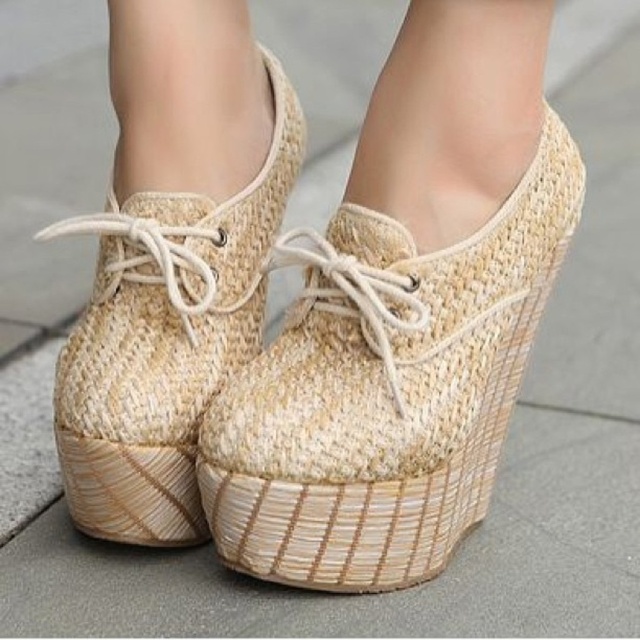
Question: Which of the following is the closest to the observer?

Choices:
 (A) [x=420, y=292]
 (B) [x=200, y=540]

Answer: (A)

Question: Does natural woven shoe at center have a greater width compared to woven beige shoe at center?

Choices:
 (A) yes
 (B) no

Answer: (A)

Question: Does natural woven shoe at center appear over woven beige shoe at center?

Choices:
 (A) yes
 (B) no

Answer: (B)

Question: In this image, where is natural woven shoe at center located relative to woven beige shoe at center?

Choices:
 (A) right
 (B) left

Answer: (A)